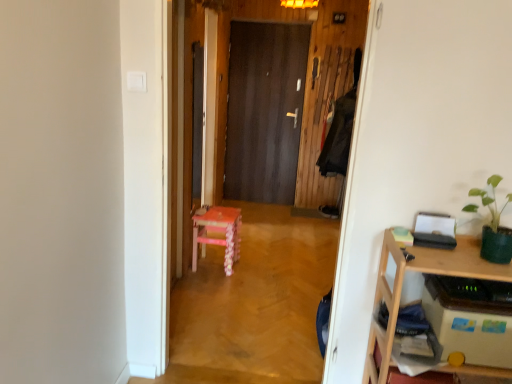
Question: Is the position of pink wood stool at center less distant than that of dark wood door at center?

Choices:
 (A) yes
 (B) no

Answer: (A)

Question: From a real-world perspective, is pink wood stool at center physically above dark wood door at center?

Choices:
 (A) no
 (B) yes

Answer: (A)

Question: Is pink wood stool at center positioned beyond the bounds of dark wood door at center?

Choices:
 (A) yes
 (B) no

Answer: (A)

Question: Is pink wood stool at center at the left side of dark wood door at center?

Choices:
 (A) yes
 (B) no

Answer: (A)

Question: From a real-world perspective, does pink wood stool at center sit lower than dark wood door at center?

Choices:
 (A) no
 (B) yes

Answer: (B)

Question: Can you confirm if pink wood stool at center is thinner than dark wood door at center?

Choices:
 (A) no
 (B) yes

Answer: (A)

Question: Does pink wood chair at center have a lesser height compared to dark wood door at center?

Choices:
 (A) yes
 (B) no

Answer: (A)

Question: Is pink wood chair at center wider than dark wood door at center?

Choices:
 (A) no
 (B) yes

Answer: (B)

Question: Is pink wood chair at center bigger than dark wood door at center?

Choices:
 (A) yes
 (B) no

Answer: (A)

Question: Is pink wood chair at center located outside dark wood door at center?

Choices:
 (A) yes
 (B) no

Answer: (A)

Question: Does pink wood chair at center appear on the right side of dark wood door at center?

Choices:
 (A) no
 (B) yes

Answer: (A)

Question: Is pink wood chair at center thinner than dark wood door at center?

Choices:
 (A) no
 (B) yes

Answer: (A)

Question: Can you confirm if pink wood stool at center is taller than green matte plant at upper right?

Choices:
 (A) yes
 (B) no

Answer: (A)